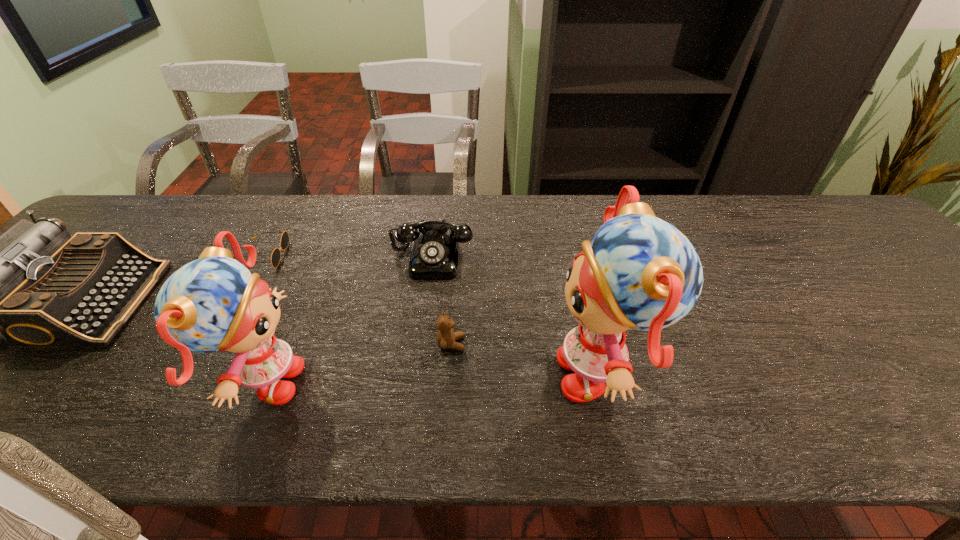
With all dolls evenly spaced, where should an extra doll be placed on the right to continue the pattern? Please point out a vacant space. Please provide its 2D coordinates. Your answer should be formatted as a tuple, i.e. [(x, y)], where the tuple contains the x and y coordinates of a point satisfying the conditions above.

[(928, 362)]